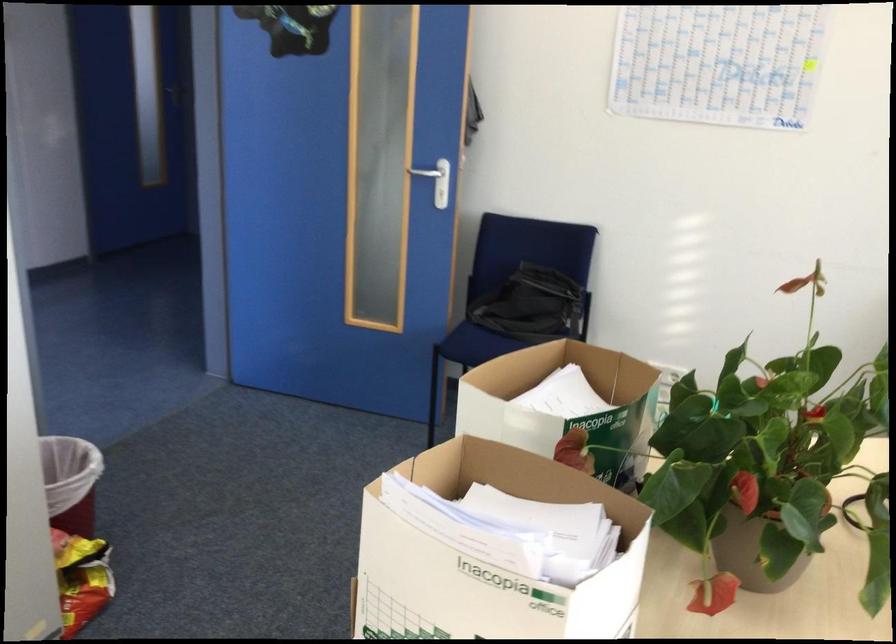
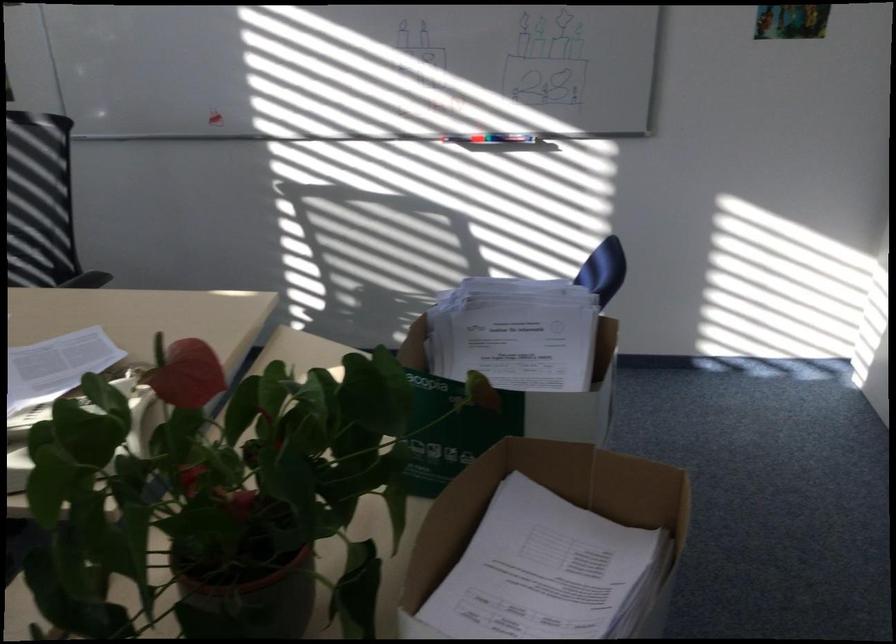
The point at (x=468, y=444) is marked in the first image. Where is the corresponding point in the second image?

(550, 515)